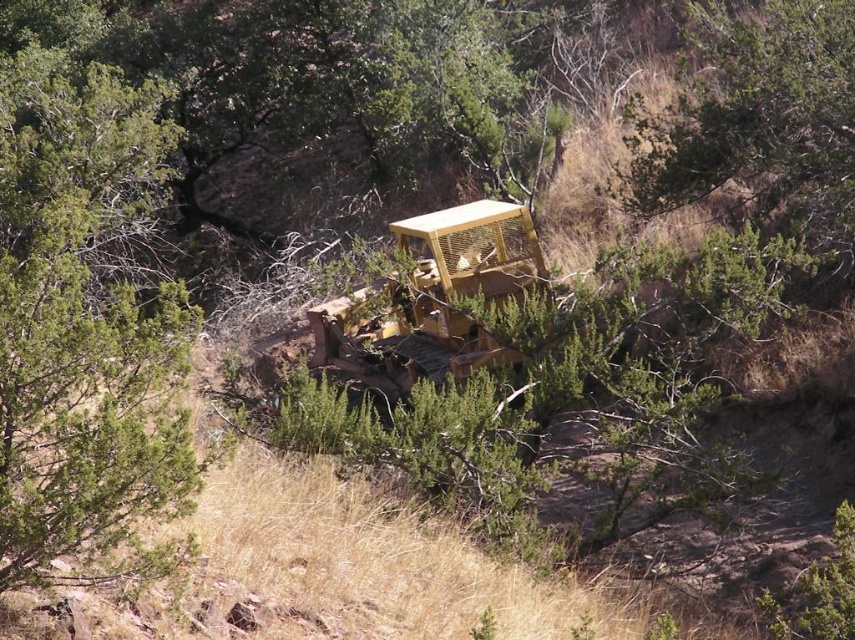
Question: Can you confirm if green leafy tree at center is positioned below green needle-like foliage at center?

Choices:
 (A) no
 (B) yes

Answer: (B)

Question: Can you confirm if green leafy tree at center is positioned above yellow metallic tractor at center?

Choices:
 (A) yes
 (B) no

Answer: (A)

Question: Does green leafy tree at center appear over yellow metallic tractor at center?

Choices:
 (A) no
 (B) yes

Answer: (B)

Question: Considering the real-world distances, which object is closest to the green needle-like foliage at center?

Choices:
 (A) yellow metallic tractor at center
 (B) green leafy tree at center

Answer: (A)

Question: Estimate the real-world distances between objects in this image. Which object is closer to the green leafy tree at center?

Choices:
 (A) green needle-like foliage at center
 (B) yellow metallic tractor at center

Answer: (B)

Question: Based on their relative distances, which object is nearer to the yellow metallic tractor at center?

Choices:
 (A) green needle-like foliage at center
 (B) green leafy tree at center

Answer: (A)